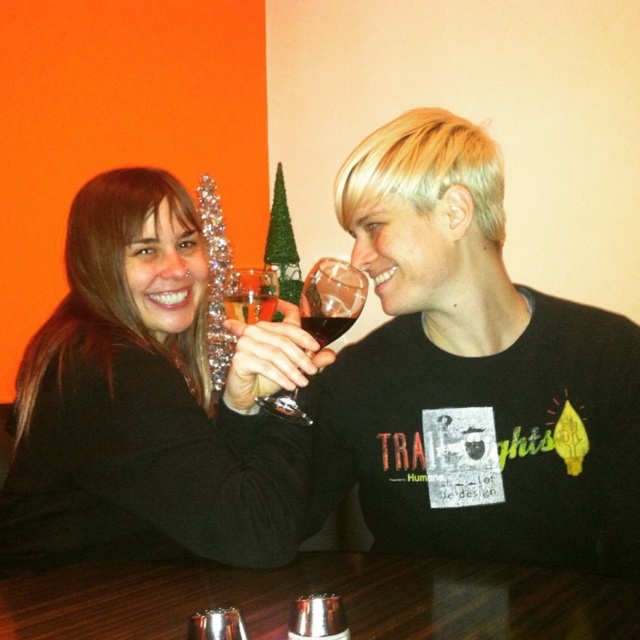
Based on the photo, you are standing in front of the table and want to place a small vase exactly at the center of the wooden table at center. The table has a coordinate system where the bottom left corner is the origin point. The coordinates of the wooden table at center are given as point (323, 592). What are the coordinates where you should place the vase?

The coordinates for placing the vase at the center of the wooden table at center would be (323, 592), as this point indicates the center of the table.

You are taking a photo of the scene and want to ensure the matte black shirt at center and the translucent glass wine at center are both in focus. Which object should you position the camera closer to if you want the other to be in the background?

The matte black shirt at center is to the right of the translucent glass wine at center. To have one in focus and the other in the background, you should position the camera closer to the matte black shirt at center since it is positioned further right, allowing the translucent glass wine at center to be in the background.

You are a bartender preparing drinks for two guests. The first guest prefers a drink in a larger glass, and the second prefers a smaller one. You have the matte black wine glass at upper left and the transparent glass wine glass at center available. Which glass should you give to each guest based on their preferences?

The matte black wine glass at upper left is larger than the transparent glass wine glass at center. Therefore, the first guest who prefers a larger glass should receive the matte black wine glass at upper left, and the second guest should get the transparent glass wine glass at center.